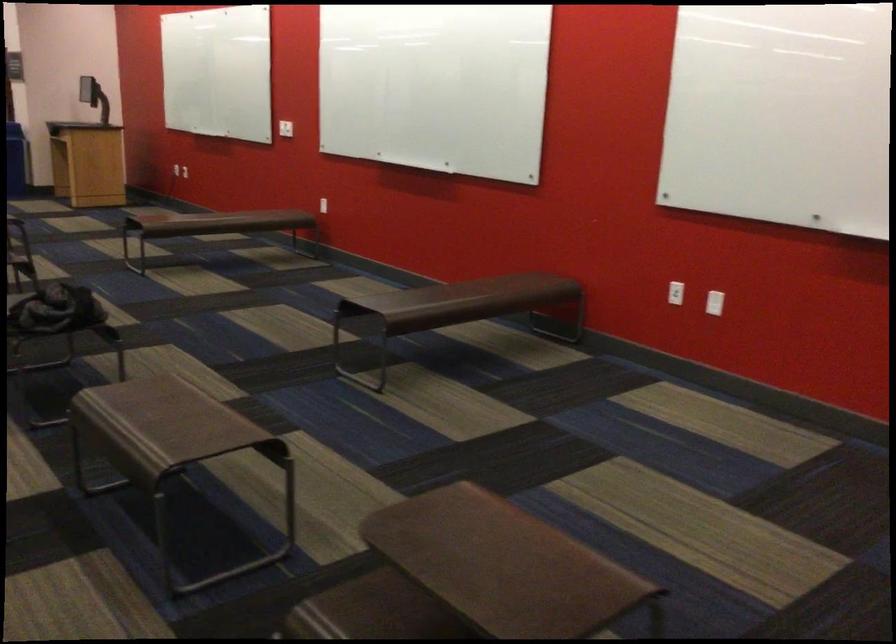
Find where to lift the blue trash can. Please return your answer as a coordinate pair (x, y).

(14, 160)